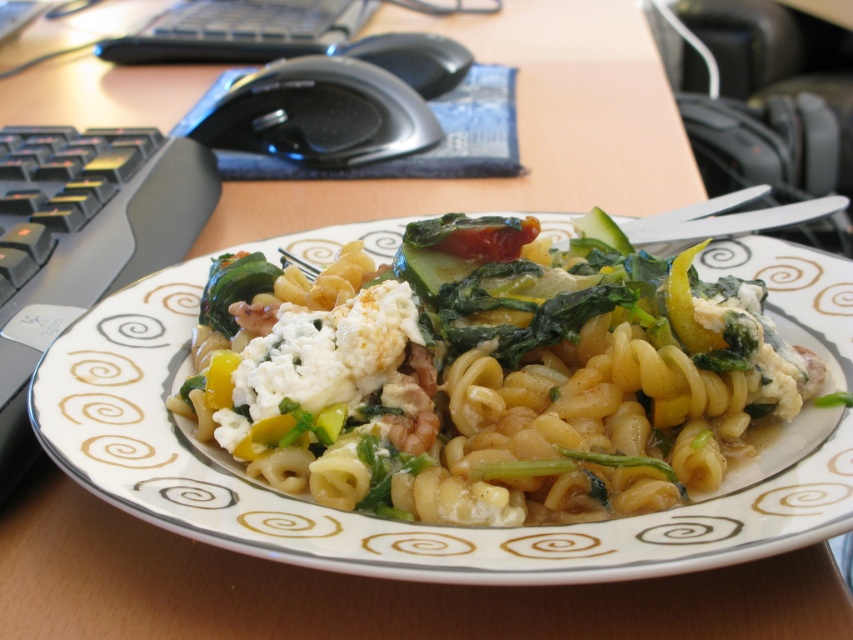
Does white crumbly cheese at center have a lesser width compared to green leafy vegetable at center?

Incorrect, white crumbly cheese at center's width is not less than green leafy vegetable at center's.

Who is more forward, (279,332) or (221,330)?

Point (279,332) is more forward.

At what (x,y) coordinates should I click in order to perform the action: click on white crumbly cheese at center. Please return your answer as a coordinate pair (x, y). Image resolution: width=853 pixels, height=640 pixels. Looking at the image, I should click on (328, 352).

Which is more to the left, yellow matte pasta at center or green leafy vegetable at center?

From the viewer's perspective, green leafy vegetable at center appears more on the left side.

Is point (421, 330) positioned after point (259, 252)?

No, it is not.

The image size is (853, 640). I want to click on yellow matte pasta at center, so 495,384.

How distant is yellow matte pasta at center from white crumbly cheese at center?

3.88 inches

Based on the photo, does yellow matte pasta at center have a smaller size compared to white crumbly cheese at center?

No.

Find the location of a particular element. The height and width of the screenshot is (640, 853). yellow matte pasta at center is located at coordinates (495, 384).

This screenshot has width=853, height=640. I want to click on yellow matte pasta at center, so click(495, 384).